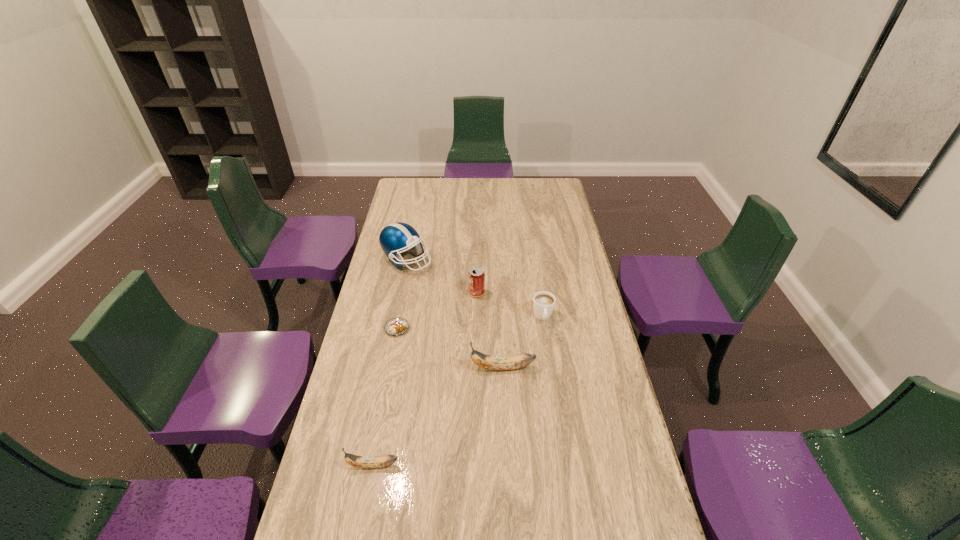
Observe the arrangement of all bananas in the image. To keep them evenly spaced, where would you place another banana on the right? Please locate a free space. Please provide its 2D coordinates. Your answer should be formatted as a tuple, i.e. [(x, y)], where the tuple contains the x and y coordinates of a point satisfying the conditions above.

[(594, 299)]